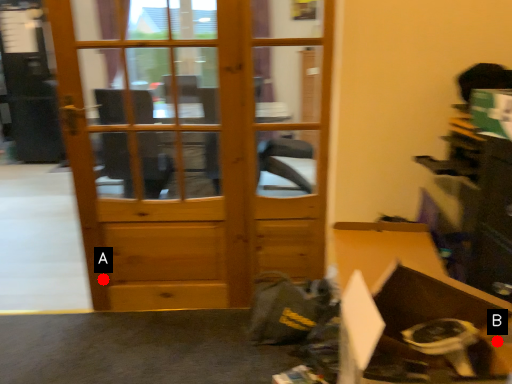
Question: Two points are circled on the image, labeled by A and B beside each circle. Which point is closer to the camera?

Choices:
 (A) A is closer
 (B) B is closer

Answer: (B)